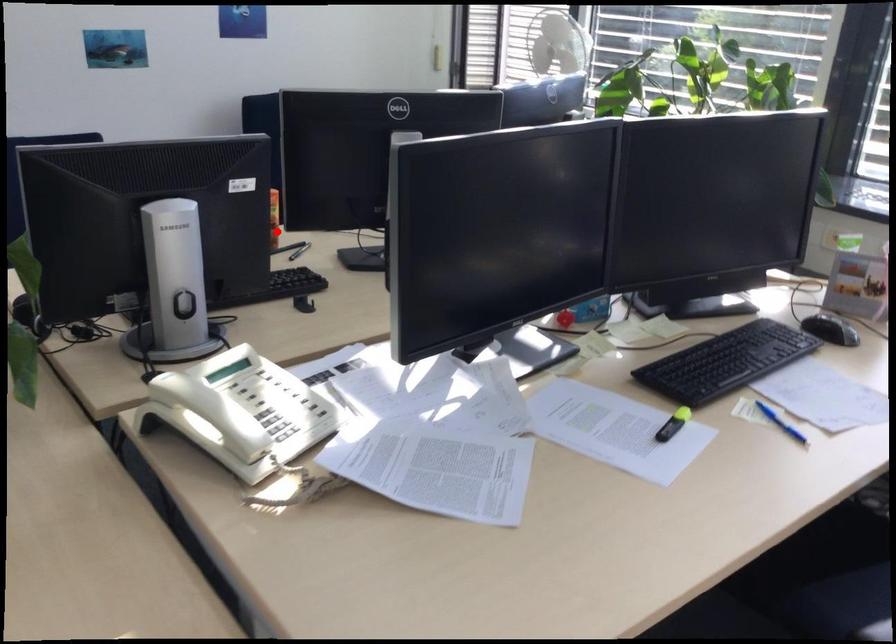
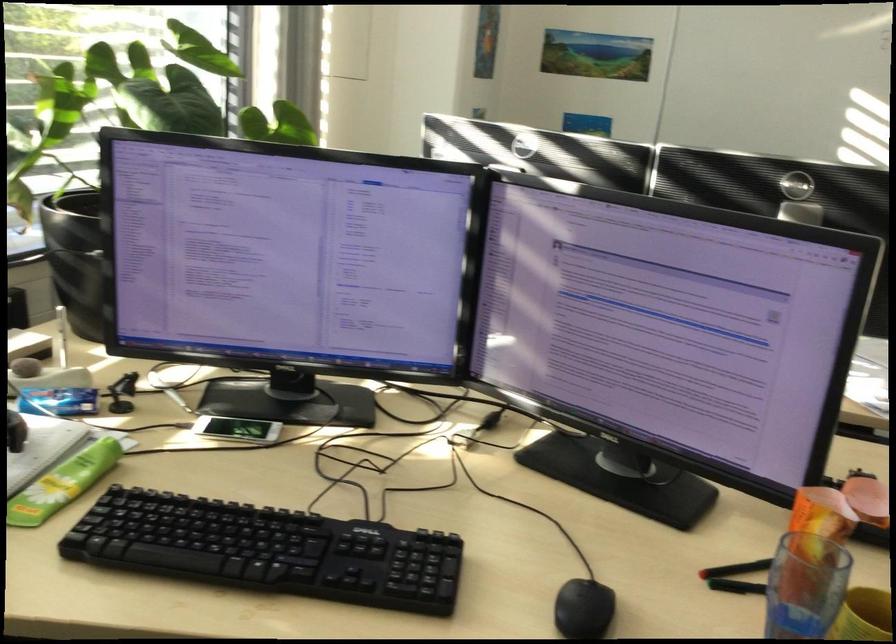
Question: I am providing you with two images of the same scene from different viewpoints. In image1, a red point is highlighted. Considering the same 3D point in image2, which of the following is correct?

Choices:
 (A) It is closer
 (B) It is farther

Answer: (A)